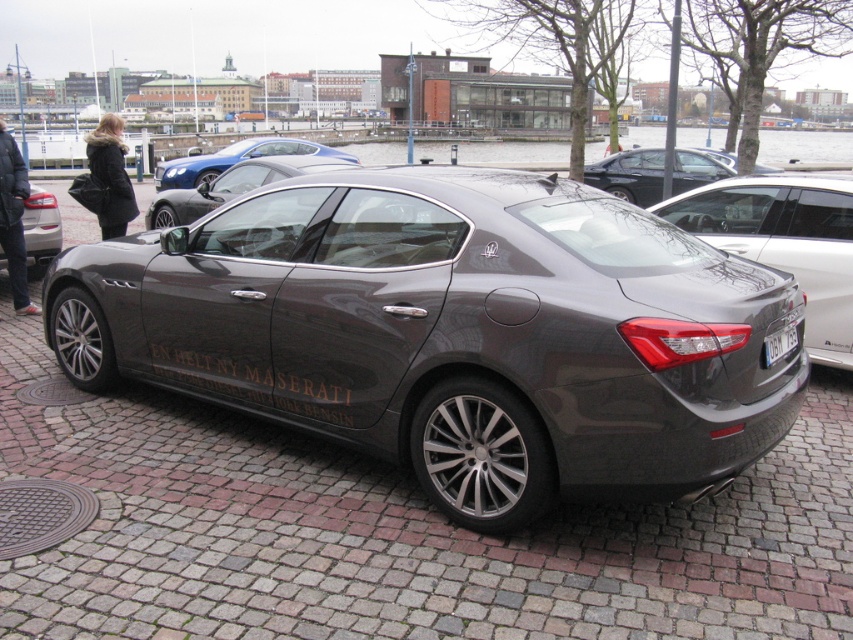
You are standing at the point labeled point (x=53, y=244) and want to walk to the point labeled point (x=712, y=253). Based on the image, will you have to walk towards the front or the back of the car?

Since point (x=712, y=253) is in front of point (x=53, y=244), you will need to walk towards the front of the car to reach your destination.

You are a photographer standing in front of the satin black car at center and the black plastic license plate at center. Which object is closer to you?

The satin black car at center is closer to you than the black plastic license plate at center.